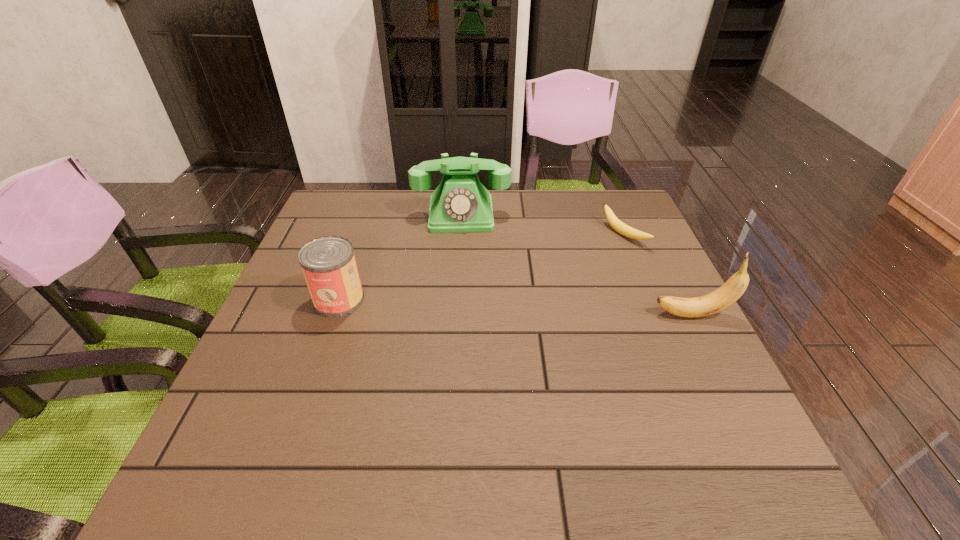
Find the location of a particular element. empty location between the shorter banana and the nearer banana is located at coordinates tap(659, 275).

The height and width of the screenshot is (540, 960). What are the coordinates of `free space between the leftmost object and the nearer banana` in the screenshot? It's located at (516, 307).

Where is `empty space between the telephone and the third tallest object`? The width and height of the screenshot is (960, 540). empty space between the telephone and the third tallest object is located at coordinates (400, 257).

The width and height of the screenshot is (960, 540). I want to click on vacant area between the shortest object and the nearer banana, so click(x=659, y=275).

The height and width of the screenshot is (540, 960). In order to click on free space between the second shortest object and the taller banana in this screenshot , I will do `click(516, 307)`.

Identify the location of vacant space that's between the taller banana and the farther banana. click(659, 275).

The image size is (960, 540). I want to click on object that stands as the second closest to the farther banana, so tap(460, 203).

Locate an element on the screen. object that is the third closest one to the taller banana is located at coordinates (328, 263).

Image resolution: width=960 pixels, height=540 pixels. In order to click on vacant space that satisfies the following two spatial constraints: 1. on the front side of the leftmost object; 2. at the start of the peel on the nearer banana in this screenshot , I will do `click(334, 315)`.

In order to click on vacant space that satisfies the following two spatial constraints: 1. on the back side of the can; 2. on the right side of the third object from right to left in this screenshot , I will do `click(369, 214)`.